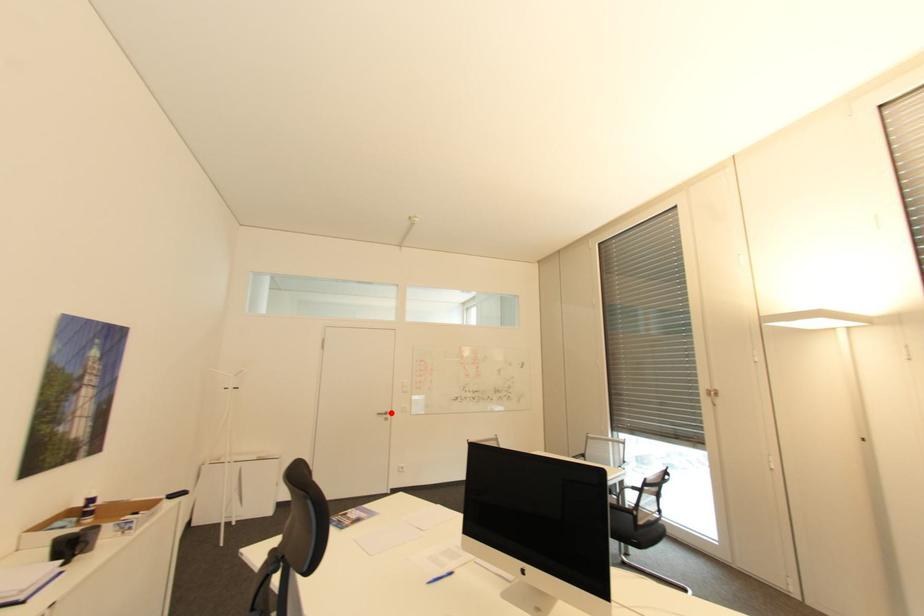
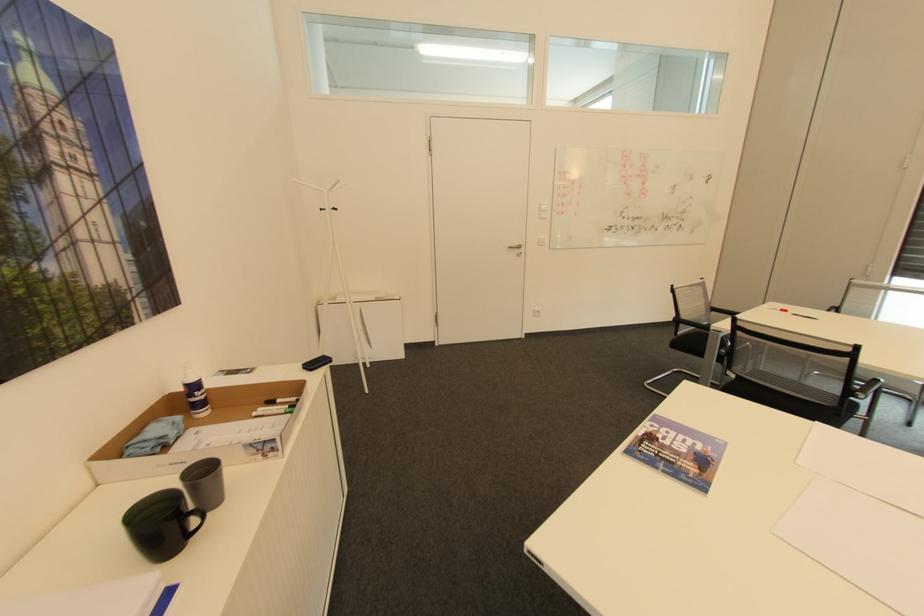
In the second image, find the point that corresponds to the highlighted location in the first image.

(524, 246)